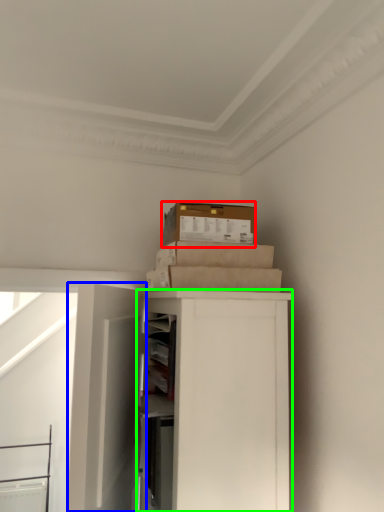
Question: Estimate the real-world distances between objects in this image. Which object is closer to box (highlighted by a red box), door (highlighted by a blue box) or cabinetry (highlighted by a green box)?

Choices:
 (A) door
 (B) cabinetry

Answer: (B)